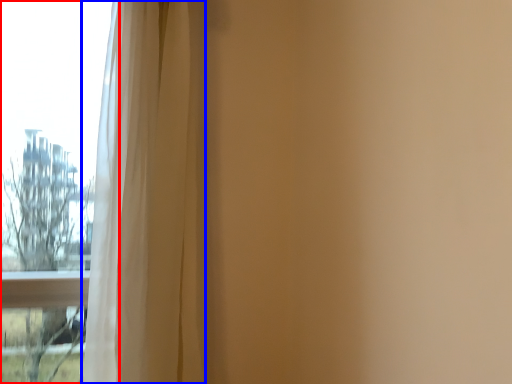
Question: Which object is closer to the camera taking this photo, window (highlighted by a red box) or curtain (highlighted by a blue box)?

Choices:
 (A) window
 (B) curtain

Answer: (B)